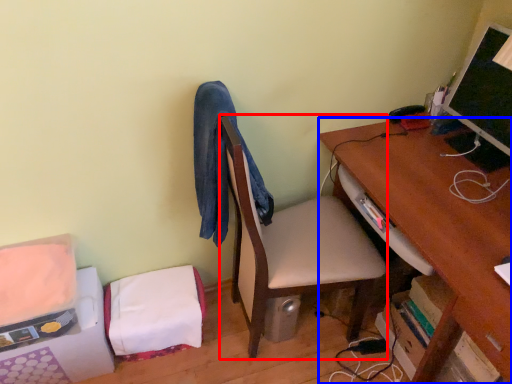
Question: Among these objects, which one is farthest to the camera, table (highlighted by a red box) or desk (highlighted by a blue box)?

Choices:
 (A) table
 (B) desk

Answer: (A)